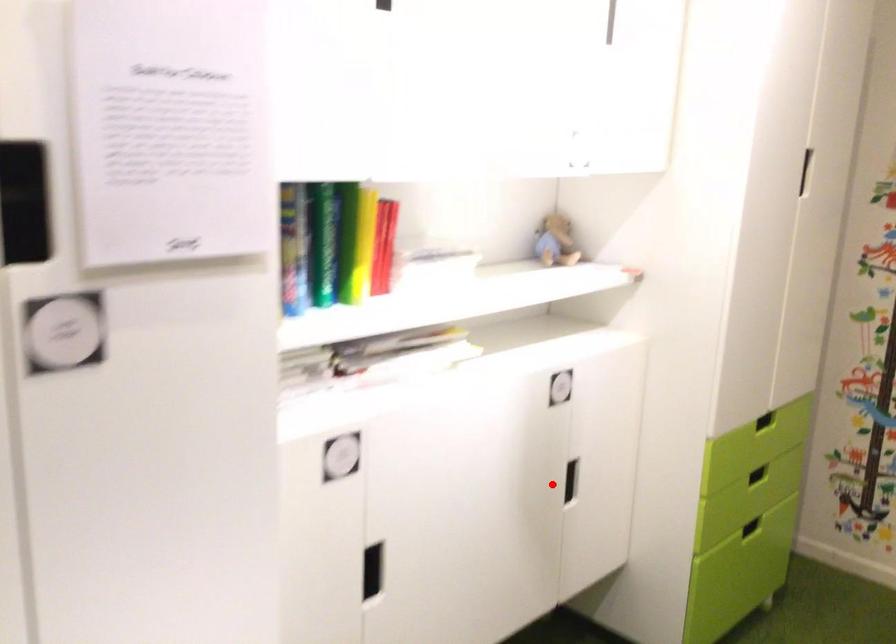
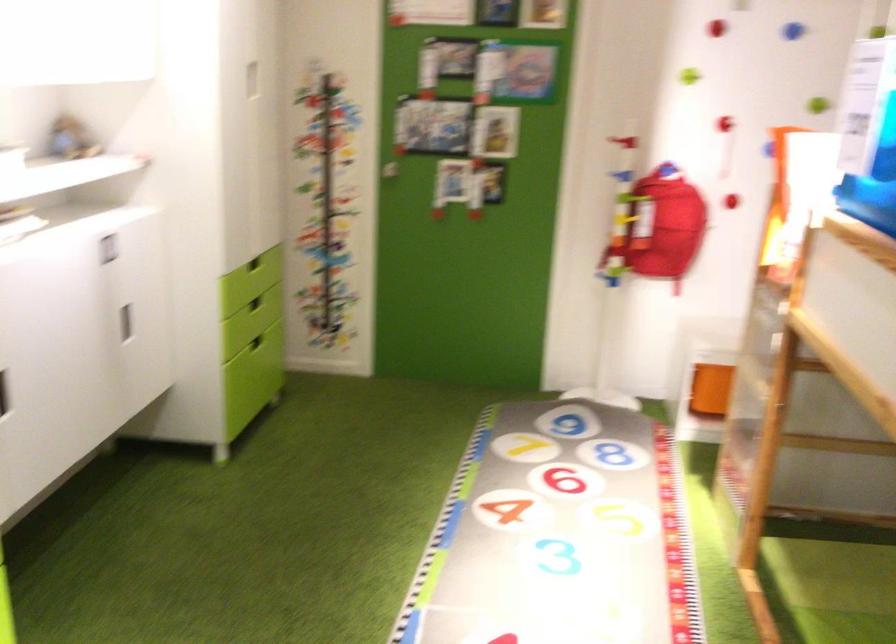
Where in the second image is the point corresponding to the highlighted location from the first image?

(125, 323)